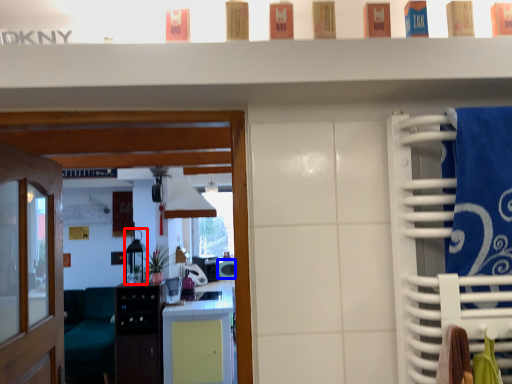
Question: Which of the following is the farthest to the observer, appliance (highlighted by a red box) or appliance (highlighted by a blue box)?

Choices:
 (A) appliance
 (B) appliance

Answer: (B)